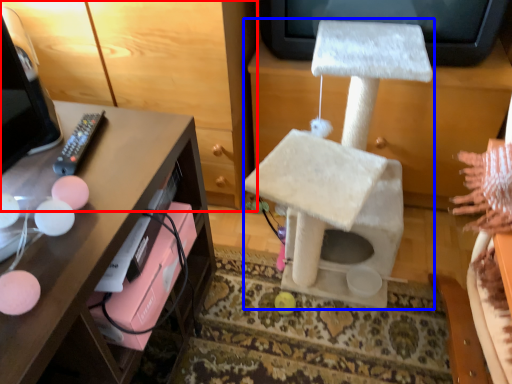
Question: Which point is closer to the camera, furniture (highlighted by a red box) or swivel chair (highlighted by a blue box)?

Choices:
 (A) furniture
 (B) swivel chair

Answer: (B)